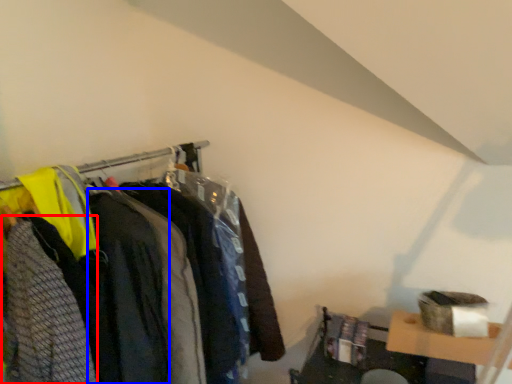
Question: Which point is closer to the camera, clothing (highlighted by a red box) or clothing (highlighted by a blue box)?

Choices:
 (A) clothing
 (B) clothing

Answer: (A)